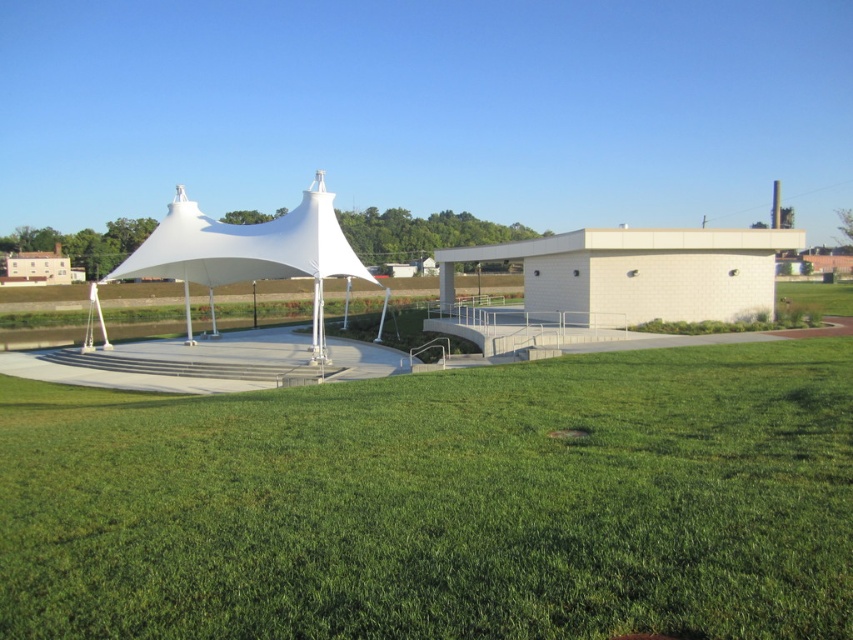
Question: Which of the following is the farthest from the observer?

Choices:
 (A) green grass at lower center
 (B) white fabric tent at center

Answer: (B)

Question: Which point is farther to the camera?

Choices:
 (A) pyautogui.click(x=331, y=234)
 (B) pyautogui.click(x=759, y=356)

Answer: (A)

Question: Does green grass at lower center have a greater width compared to white fabric tent at center?

Choices:
 (A) no
 (B) yes

Answer: (B)

Question: Is green grass at lower center below white fabric tent at center?

Choices:
 (A) no
 (B) yes

Answer: (B)

Question: Is green grass at lower center thinner than white fabric tent at center?

Choices:
 (A) no
 (B) yes

Answer: (A)